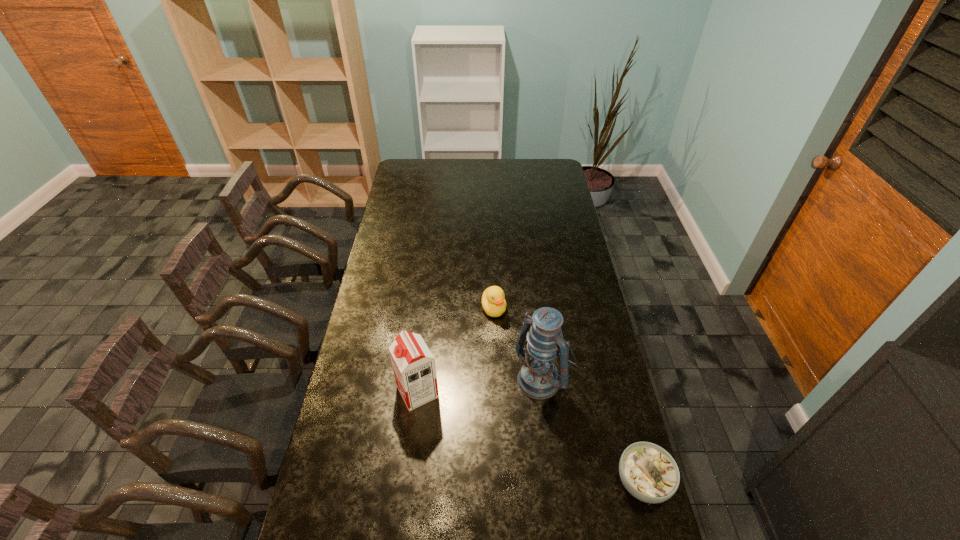
At what (x,y) coordinates should I click in order to perform the action: click on vacant point at the far edge. Please return your answer as a coordinate pair (x, y). This screenshot has height=540, width=960. Looking at the image, I should click on [x=479, y=161].

The image size is (960, 540). What are the coordinates of `free space at the near edge` in the screenshot? It's located at (482, 522).

Where is `vacant space at the left edge`? This screenshot has height=540, width=960. vacant space at the left edge is located at coordinates (369, 312).

In the image, there is a desktop. In order to click on free space at the far left corner in this screenshot , I will do `click(415, 159)`.

This screenshot has height=540, width=960. Find the location of `empty space that is in between the third object from right to left and the soya milk`. empty space that is in between the third object from right to left and the soya milk is located at coordinates (456, 350).

Image resolution: width=960 pixels, height=540 pixels. In order to click on empty space that is in between the soya milk and the rightmost object in this screenshot , I will do `click(530, 437)`.

Identify the location of empty space between the nearest object and the lantern. Image resolution: width=960 pixels, height=540 pixels. (592, 429).

At what (x,y) coordinates should I click in order to perform the action: click on empty location between the rightmost object and the tallest object. Please return your answer as a coordinate pair (x, y). Looking at the image, I should click on (592, 429).

At what (x,y) coordinates should I click in order to perform the action: click on blank region between the second shortest object and the second tallest object. Please return your answer as a coordinate pair (x, y). The height and width of the screenshot is (540, 960). Looking at the image, I should click on (456, 350).

Find the location of a particular element. The image size is (960, 540). free area in between the rightmost object and the second tallest object is located at coordinates (530, 437).